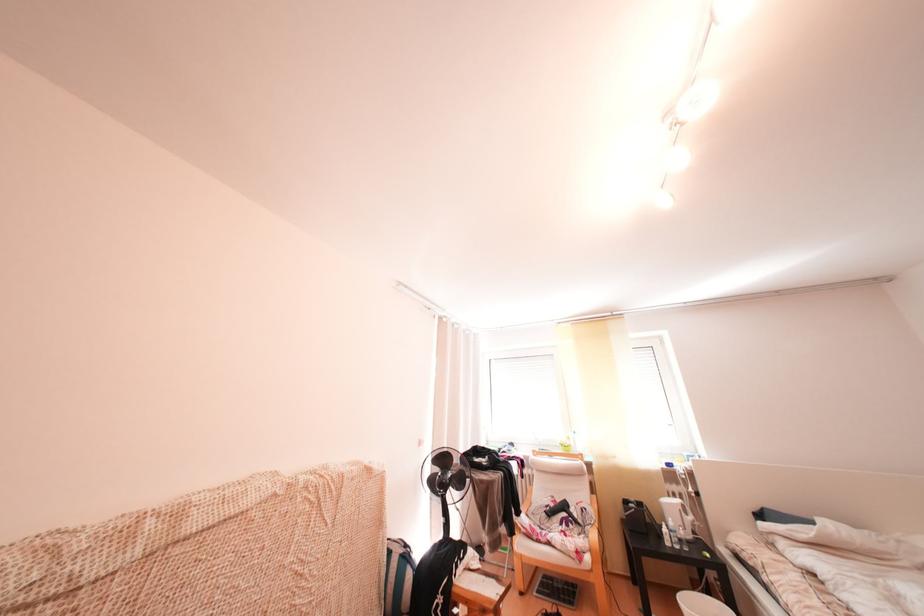
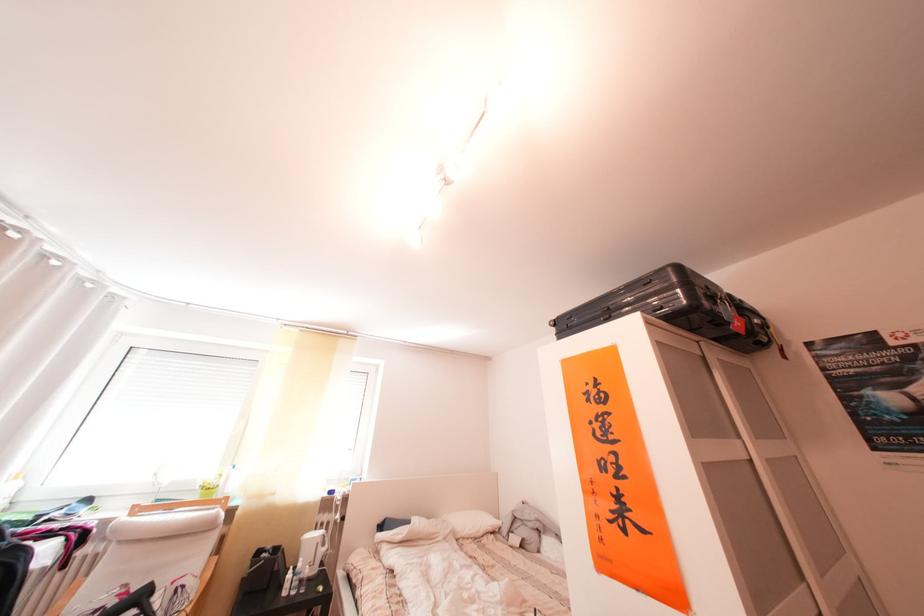
Question: The camera is either moving clockwise (left) or counter-clockwise (right) around the object. The first image is from the beginning of the video and the second image is from the end. Is the camera moving left or right when shooting the video?

Choices:
 (A) Left
 (B) Right

Answer: (A)